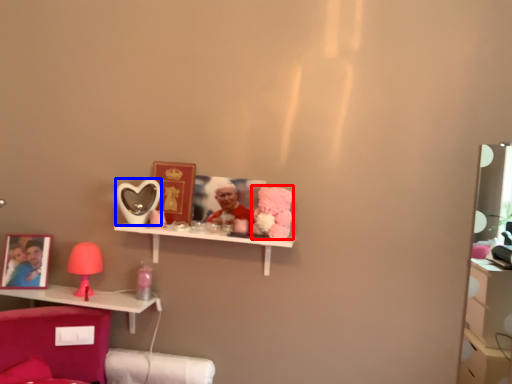
Question: Which object appears farthest to the camera in this image, toy (highlighted by a red box) or mirror (highlighted by a blue box)?

Choices:
 (A) toy
 (B) mirror

Answer: (B)